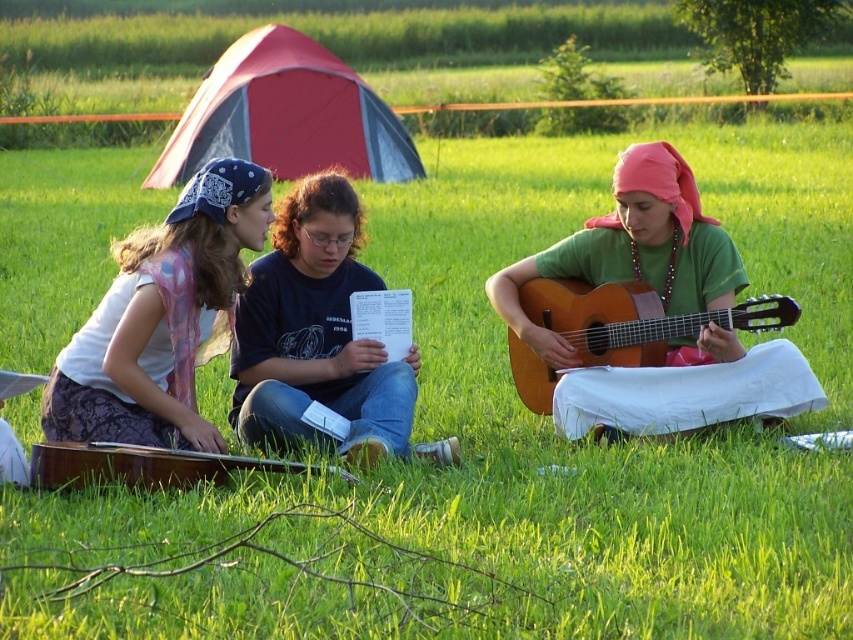
You are organizing a picnic and need to decide which item to bring first between the matte pink scarf at left and the red fabric tent at upper center. Based on their sizes, which one should you choose to carry first?

The matte pink scarf at left is larger in size than the red fabric tent at upper center, so you should carry the matte pink scarf at left first as it requires more space.

What is the exact location of the red fabric tent at upper center in the image?

The red fabric tent at upper center is located at point (x=286, y=115).

You are a photographer taking a picture of the matte pink scarf at left and the matte black shirt at center. Which object will appear larger in the photo?

The matte pink scarf at left appears larger in the photo because it is closer to the viewer than the matte black shirt at center.